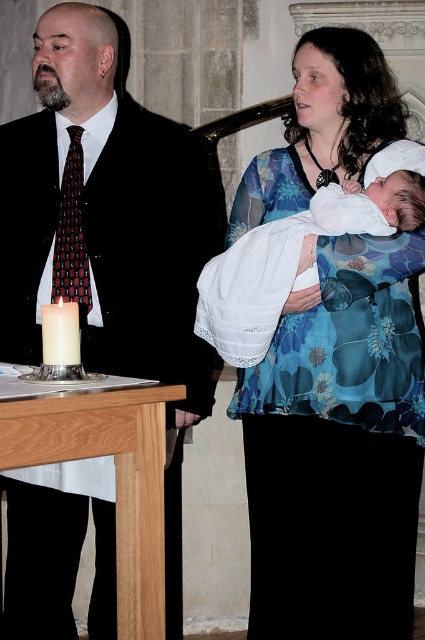
You are attending a church ceremony and notice the blue floral dress at center and the white wax candle at lower left. Based on their positions, which object is closer to the right side of the room?

The blue floral dress at center is closer to the right side of the room because it is positioned to the right of the white wax candle at lower left.

You are an event photographer at a formal event. You need to capture a photo of the matte black suit at left and the dark red textured tie at left. According to the scene, which one is more to the right?

The matte black suit at left is positioned on the right side of dark red textured tie at left, so the matte black suit at left is more to the right.

You are a photographer setting up for a formal event. You notice the dark red textured tie at left and the white wax candle at lower left in the scene. Which object would block the view of the other if placed directly in front of it?

The dark red textured tie at left is taller than the white wax candle at lower left, so if placed directly in front, the dark red textured tie at left would block the view of the white wax candle at lower left.